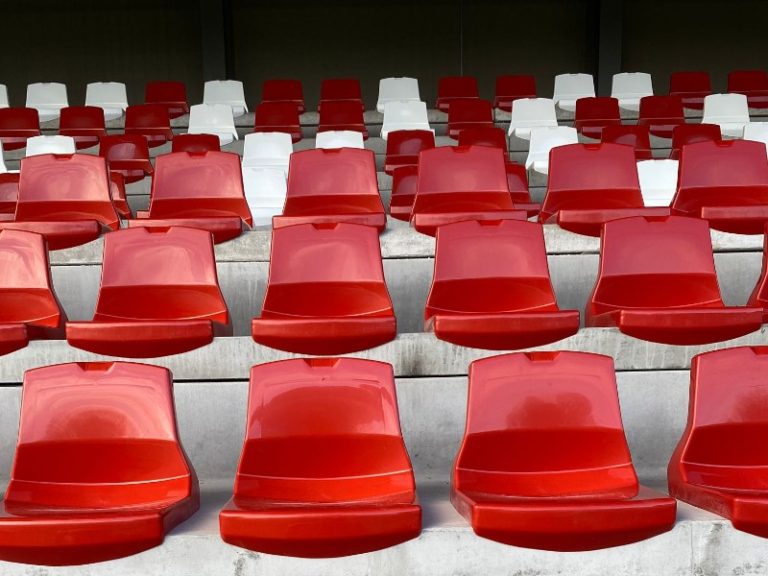
Locate an element on the screen. seats in the front row is located at coordinates (742, 435), (561, 433), (363, 422), (88, 414).